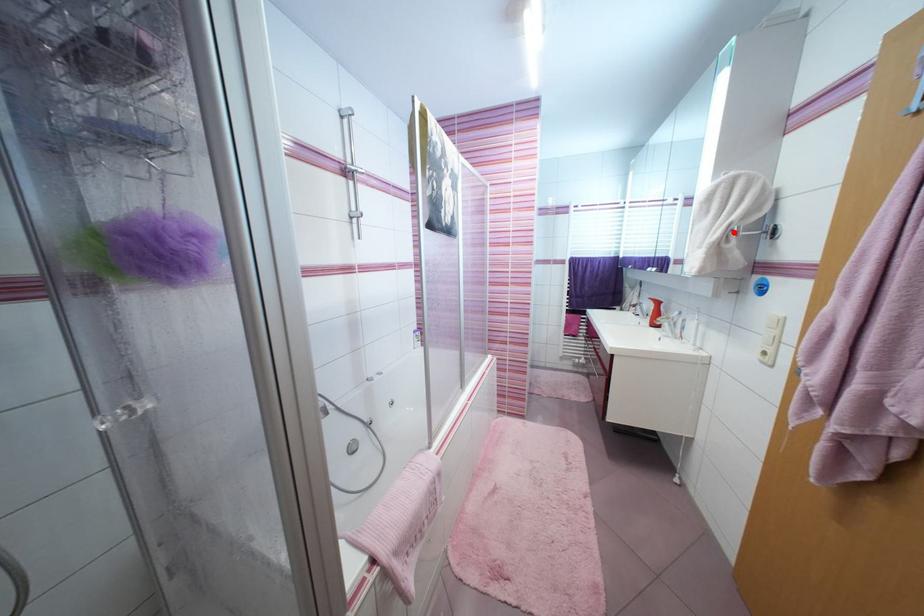
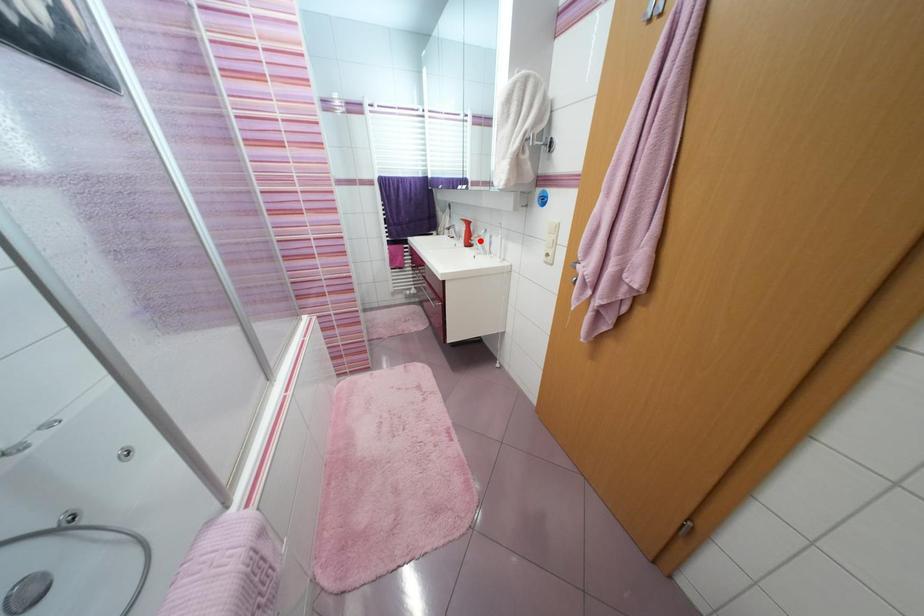
I am providing you with two images of the same scene from different viewpoints. A red point is marked on the first image and another point is marked on the second image. Are the points marked in image1 and image2 representing the same 3D position?

No